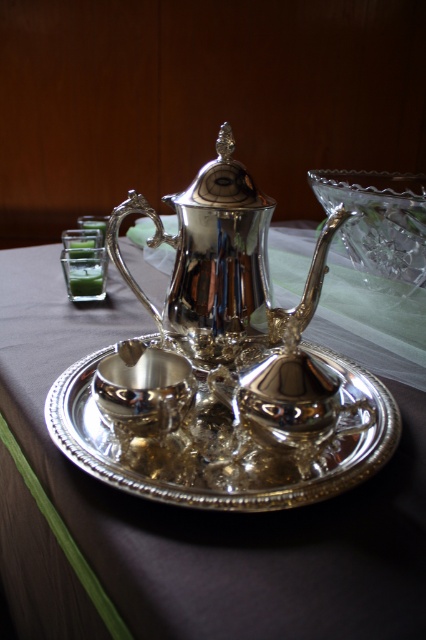
Is shiny silver tray at center shorter than polished silver saucer at center?

In fact, shiny silver tray at center may be taller than polished silver saucer at center.

Between shiny silver tray at center and polished silver saucer at center, which one has more height?

Answer: shiny silver tray at center

Identify the location of shiny silver tray at center. (212, 512).

From the picture: Who is positioned more to the right, polished silver saucer at center or polished silver teapot at center?

From the viewer's perspective, polished silver saucer at center appears more on the right side.

Is polished silver saucer at center to the right of polished silver teapot at center from the viewer's perspective?

Correct, you'll find polished silver saucer at center to the right of polished silver teapot at center.

At what (x,y) coordinates should I click in order to perform the action: click on polished silver saucer at center. Please return your answer as a coordinate pair (x, y). Looking at the image, I should click on (226, 442).

Is shiny silver tray at center above polished silver sugar bowl at center?

Actually, shiny silver tray at center is below polished silver sugar bowl at center.

Can you confirm if shiny silver tray at center is smaller than polished silver sugar bowl at center?

No, shiny silver tray at center is not smaller than polished silver sugar bowl at center.

Who is more distant from viewer, (32, 513) or (138, 349)?

The point (32, 513) is more distant.

Where is `shiny silver tray at center`? shiny silver tray at center is located at coordinates (212, 512).